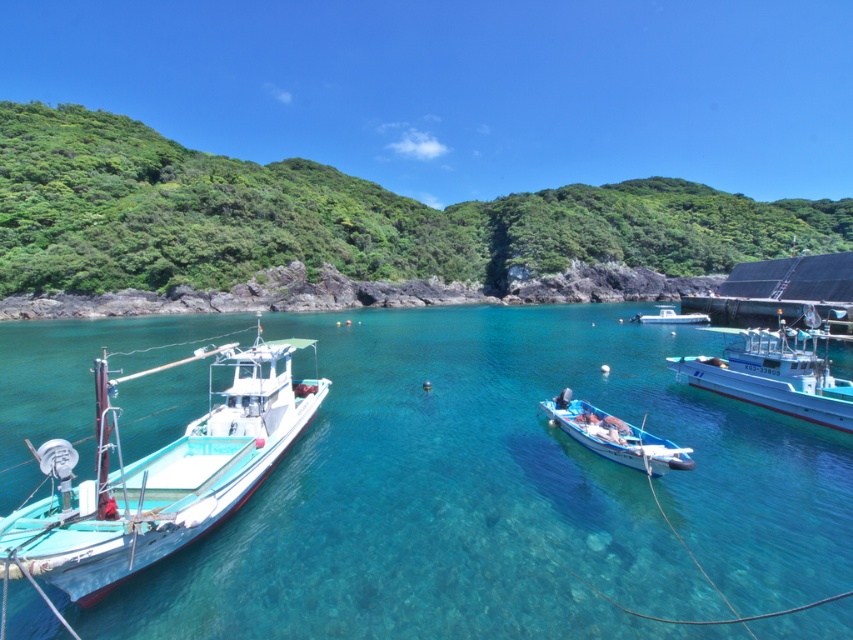
Question: Which object is the closest to the white glossy boat at right?

Choices:
 (A) white wooden boat at center
 (B) white glossy boat at center

Answer: (A)

Question: Is clear blue water at center wider than white wooden boat at center?

Choices:
 (A) no
 (B) yes

Answer: (B)

Question: Which point is closer to the camera?

Choices:
 (A) (695, 552)
 (B) (265, 374)
 (C) (666, 316)

Answer: (A)

Question: Based on their relative distances, which object is farther from the teal matte boat at left?

Choices:
 (A) clear blue water at center
 (B) white wooden boat at center
 (C) white glossy boat at right
 (D) white glossy boat at center

Answer: (D)

Question: Can you confirm if clear blue water at center is thinner than white glossy boat at center?

Choices:
 (A) yes
 (B) no

Answer: (B)

Question: Does clear blue water at center have a larger size compared to teal matte boat at left?

Choices:
 (A) yes
 (B) no

Answer: (A)